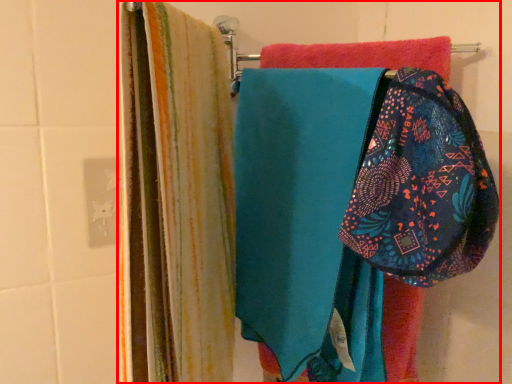
Question: From the image's perspective, what is the correct spatial relationship of laundry (annotated by the red box) in relation to pouch?

Choices:
 (A) above
 (B) below

Answer: (B)